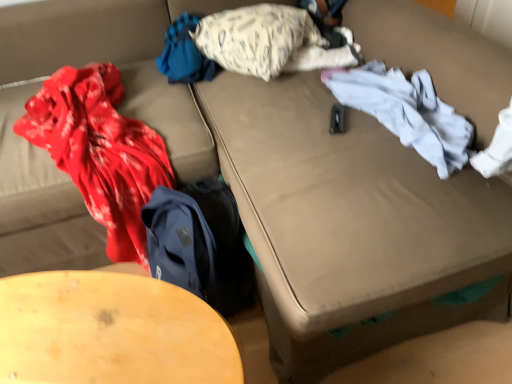
Question: From the image's perspective, relative to wooden table at lower left, is white textured pillow at upper center above or below?

Choices:
 (A) below
 (B) above

Answer: (B)

Question: Is white textured pillow at upper center taller or shorter than wooden table at lower left?

Choices:
 (A) tall
 (B) short

Answer: (B)

Question: Estimate the real-world distances between objects in this image. Which object is closer to the blue fabric at upper center, the 1th clothing viewed from the left?

Choices:
 (A) white cotton shirt at right, the 2th clothing positioned from the left
 (B) wooden table at lower left
 (C) white textured pillow at upper center

Answer: (C)

Question: Which object is positioned closest to the white textured pillow at upper center?

Choices:
 (A) white cotton shirt at right, which appears as the first clothing when viewed from the right
 (B) wooden table at lower left
 (C) blue fabric at upper center, the 1th clothing viewed from the left

Answer: (C)